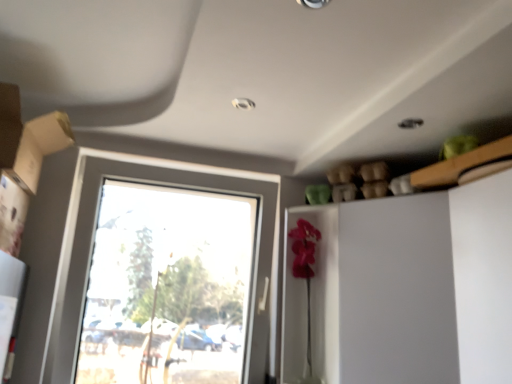
Question: Does clear glass window at center have a greater width compared to white glossy dresser at right?

Choices:
 (A) yes
 (B) no

Answer: (B)

Question: Considering the relative sizes of clear glass window at center and white glossy dresser at right in the image provided, is clear glass window at center shorter than white glossy dresser at right?

Choices:
 (A) no
 (B) yes

Answer: (A)

Question: From the image's perspective, would you say clear glass window at center is positioned over white glossy dresser at right?

Choices:
 (A) yes
 (B) no

Answer: (A)

Question: From a real-world perspective, is clear glass window at center on white glossy dresser at right?

Choices:
 (A) no
 (B) yes

Answer: (B)

Question: Is clear glass window at center closer to camera compared to white glossy dresser at right?

Choices:
 (A) yes
 (B) no

Answer: (B)

Question: In terms of width, does white glossy dresser at right look wider or thinner when compared to clear glass window at center?

Choices:
 (A) wide
 (B) thin

Answer: (A)

Question: Looking at the image, does white glossy dresser at right seem bigger or smaller compared to clear glass window at center?

Choices:
 (A) big
 (B) small

Answer: (A)

Question: From a real-world perspective, relative to clear glass window at center, is white glossy dresser at right vertically above or below?

Choices:
 (A) above
 (B) below

Answer: (B)

Question: From the image's perspective, is white glossy dresser at right above or below clear glass window at center?

Choices:
 (A) above
 (B) below

Answer: (B)

Question: Considering the positions of clear glass window at center and matte cardboard box at left in the image, is clear glass window at center wider or thinner than matte cardboard box at left?

Choices:
 (A) wide
 (B) thin

Answer: (B)

Question: Based on their positions, is clear glass window at center located to the left or right of matte cardboard box at left?

Choices:
 (A) right
 (B) left

Answer: (A)

Question: Is clear glass window at center in front of or behind matte cardboard box at left in the image?

Choices:
 (A) front
 (B) behind

Answer: (B)

Question: From a real-world perspective, relative to matte cardboard box at left, is clear glass window at center vertically above or below?

Choices:
 (A) above
 (B) below

Answer: (B)

Question: From a real-world perspective, is white glossy dresser at right above or below matte cardboard box at left?

Choices:
 (A) below
 (B) above

Answer: (A)

Question: Considering their positions, is white glossy dresser at right located in front of or behind matte cardboard box at left?

Choices:
 (A) behind
 (B) front

Answer: (A)